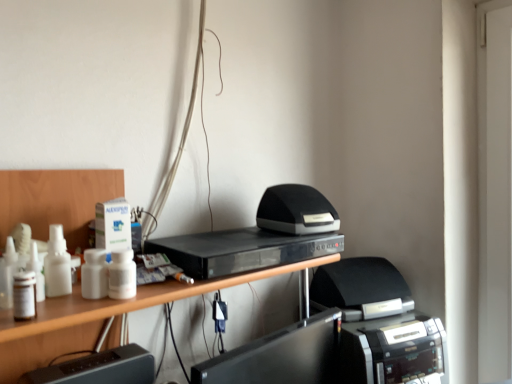
The width and height of the screenshot is (512, 384). Identify the location of black plastic register at lower left, acting as the 2th register starting from the right. (99, 368).

Identify the location of black glossy monitor at lower center, arranged as the 2th register when viewed from the left. (280, 356).

Measure the distance from black plastic printer at lower right, the second printer viewed from the top, to black glossy monitor at lower center, arranged as the 2th register when viewed from the left.

black plastic printer at lower right, the second printer viewed from the top, is 6.03 inches away from black glossy monitor at lower center, arranged as the 2th register when viewed from the left.

Considering the relative sizes of black plastic printer at lower right, which is the 1th printer in bottom-to-top order, and black glossy monitor at lower center, the first register from the right, in the image provided, is black plastic printer at lower right, which is the 1th printer in bottom-to-top order, shorter than black glossy monitor at lower center, the first register from the right,?

No.

From a real-world perspective, is black plastic printer at lower right, the second printer viewed from the top, positioned under black glossy monitor at lower center, the first register from the right, based on gravity?

Yes, from a real-world perspective, black plastic printer at lower right, the second printer viewed from the top, is under black glossy monitor at lower center, the first register from the right.

Image resolution: width=512 pixels, height=384 pixels. Find the location of `the 1st printer above when counting from the black glossy monitor at lower center, arranged as the 2th register when viewed from the left (from the image's perspective)`. the 1st printer above when counting from the black glossy monitor at lower center, arranged as the 2th register when viewed from the left (from the image's perspective) is located at coordinates (380, 324).

Is black plastic register at lower left, acting as the 2th register starting from the right, inside black plastic dvd player at center?

No, black plastic dvd player at center does not contain black plastic register at lower left, acting as the 2th register starting from the right.

Does black plastic dvd player at center have a lesser width compared to black plastic register at lower left, acting as the 2th register starting from the right?

Incorrect, the width of black plastic dvd player at center is not less than that of black plastic register at lower left, acting as the 2th register starting from the right.

Considering the relative sizes of black plastic dvd player at center and black plastic register at lower left, the first register positioned from the left, in the image provided, is black plastic dvd player at center bigger than black plastic register at lower left, the first register positioned from the left,?

Yes, black plastic dvd player at center is bigger than black plastic register at lower left, the first register positioned from the left.

From a real-world perspective, is black plastic dvd player at center positioned under black plastic register at lower left, acting as the 2th register starting from the right, based on gravity?

No, from a real-world perspective, black plastic dvd player at center is not under black plastic register at lower left, acting as the 2th register starting from the right.

How many degrees apart are the facing directions of black plastic register at lower left, the first register positioned from the left, and black glossy monitor at lower center, the first register from the right?

The angle between the facing direction of black plastic register at lower left, the first register positioned from the left, and the facing direction of black glossy monitor at lower center, the first register from the right, is 0.707 degrees.

Does black plastic register at lower left, the first register positioned from the left, have a lesser width compared to black glossy monitor at lower center, arranged as the 2th register when viewed from the left?

Yes, black plastic register at lower left, the first register positioned from the left, is thinner than black glossy monitor at lower center, arranged as the 2th register when viewed from the left.

Is point (135, 380) positioned in front of point (289, 359)?

Yes, point (135, 380) is in front of point (289, 359).

Is black glossy monitor at lower center, the first register from the right, inside black plastic register at lower left, acting as the 2th register starting from the right?

No, black glossy monitor at lower center, the first register from the right, is not a part of black plastic register at lower left, acting as the 2th register starting from the right.

Looking at this image, considering the relative positions of black glossy monitor at lower center, arranged as the 2th register when viewed from the left, and black plastic register at lower left, acting as the 2th register starting from the right, in the image provided, is black glossy monitor at lower center, arranged as the 2th register when viewed from the left, behind black plastic register at lower left, acting as the 2th register starting from the right,?

No.

Would you say black glossy monitor at lower center, arranged as the 2th register when viewed from the left, contains black plastic register at lower left, acting as the 2th register starting from the right?

That's incorrect, black plastic register at lower left, acting as the 2th register starting from the right, is not inside black glossy monitor at lower center, arranged as the 2th register when viewed from the left.

From a real-world perspective, which is physically above, black glossy monitor at lower center, arranged as the 2th register when viewed from the left, or black plastic register at lower left, the first register positioned from the left?

→ black plastic register at lower left, the first register positioned from the left, is physically above.

Can you tell me how much black glossy monitor at lower center, the first register from the right, and black plastic register at lower left, the first register positioned from the left, differ in facing direction?

The facing directions of black glossy monitor at lower center, the first register from the right, and black plastic register at lower left, the first register positioned from the left, are 0.707 degrees apart.

Does black matte speaker at center, the first printer positioned from the top, have a lesser height compared to black plastic register at lower left, acting as the 2th register starting from the right?

In fact, black matte speaker at center, the first printer positioned from the top, may be taller than black plastic register at lower left, acting as the 2th register starting from the right.

Based on the photo, considering the sizes of objects black matte speaker at center, the first printer positioned from the top, and black plastic register at lower left, the first register positioned from the left, in the image provided, who is thinner, black matte speaker at center, the first printer positioned from the top, or black plastic register at lower left, the first register positioned from the left,?

With smaller width is black plastic register at lower left, the first register positioned from the left.

Is black plastic register at lower left, the first register positioned from the left, at the back of black matte speaker at center, the first printer positioned from the top?

No, black matte speaker at center, the first printer positioned from the top, is not facing away from black plastic register at lower left, the first register positioned from the left.

Is black matte speaker at center, the first printer positioned from the top, at the left side of black plastic register at lower left, the first register positioned from the left?

No.

Does point (434, 343) come in front of point (300, 194)?

No, (434, 343) is further to viewer.

Is black plastic printer at lower right, which is the 1th printer in bottom-to-top order, in front of or behind black matte speaker at center, which ranks as the second printer in bottom-to-top order, in the image?

Visually, black plastic printer at lower right, which is the 1th printer in bottom-to-top order, is located behind black matte speaker at center, which ranks as the second printer in bottom-to-top order.

Is black plastic printer at lower right, which is the 1th printer in bottom-to-top order, with black matte speaker at center, the first printer positioned from the top?

black plastic printer at lower right, which is the 1th printer in bottom-to-top order, and black matte speaker at center, the first printer positioned from the top, are not in contact.

Considering the relative sizes of black plastic dvd player at center and black plastic printer at lower right, which is the 1th printer in bottom-to-top order, in the image provided, is black plastic dvd player at center wider than black plastic printer at lower right, which is the 1th printer in bottom-to-top order,?

No, black plastic dvd player at center is not wider than black plastic printer at lower right, which is the 1th printer in bottom-to-top order.

Is there a large distance between black plastic dvd player at center and black plastic printer at lower right, the second printer viewed from the top?

No, there isn't a large distance between black plastic dvd player at center and black plastic printer at lower right, the second printer viewed from the top.

From a real-world perspective, is black plastic dvd player at center physically located above or below black plastic printer at lower right, which is the 1th printer in bottom-to-top order?

Clearly, from a real-world perspective, black plastic dvd player at center is above black plastic printer at lower right, which is the 1th printer in bottom-to-top order.

Considering the positions of point (306, 254) and point (376, 278), is point (306, 254) closer or farther from the camera than point (376, 278)?

Point (306, 254).

Where is `the 2nd printer behind the black glossy monitor at lower center, arranged as the 2th register when viewed from the left, starting your count from the anchor`? This screenshot has width=512, height=384. the 2nd printer behind the black glossy monitor at lower center, arranged as the 2th register when viewed from the left, starting your count from the anchor is located at coordinates (380, 324).

Locate an element on the screen. The height and width of the screenshot is (384, 512). home appliance above the black plastic register at lower left, the first register positioned from the left (from a real-world perspective) is located at coordinates (241, 250).

In the scene shown: Which object lies nearer to the anchor point black plastic dvd player at center, black matte speaker at center, the first printer positioned from the top, or black glossy monitor at lower center, the first register from the right?

black matte speaker at center, the first printer positioned from the top, lies closer to black plastic dvd player at center than the other object.

In the scene shown: When comparing their distances from black glossy monitor at lower center, the first register from the right, does black plastic register at lower left, acting as the 2th register starting from the right, or black matte speaker at center, which ranks as the second printer in bottom-to-top order, seem further?

Among the two, black matte speaker at center, which ranks as the second printer in bottom-to-top order, is located further to black glossy monitor at lower center, the first register from the right.

Based on their spatial positions, is black matte speaker at center, the first printer positioned from the top, or black plastic dvd player at center closer to black plastic printer at lower right, the second printer viewed from the top?

black plastic dvd player at center.

Based on their spatial positions, is black glossy monitor at lower center, arranged as the 2th register when viewed from the left, or black plastic dvd player at center closer to black plastic register at lower left, acting as the 2th register starting from the right?

black glossy monitor at lower center, arranged as the 2th register when viewed from the left, is closer to black plastic register at lower left, acting as the 2th register starting from the right.

From the image, which object appears to be nearer to black plastic printer at lower right, which is the 1th printer in bottom-to-top order, black glossy monitor at lower center, arranged as the 2th register when viewed from the left, or black plastic dvd player at center?

Based on the image, black glossy monitor at lower center, arranged as the 2th register when viewed from the left, appears to be nearer to black plastic printer at lower right, which is the 1th printer in bottom-to-top order.

Consider the image. Estimate the real-world distances between objects in this image. Which object is further from black matte speaker at center, the first printer positioned from the top, black plastic dvd player at center or black glossy monitor at lower center, arranged as the 2th register when viewed from the left?

black glossy monitor at lower center, arranged as the 2th register when viewed from the left, is further to black matte speaker at center, the first printer positioned from the top.

From the picture: From the image, which object appears to be farther from black plastic register at lower left, the first register positioned from the left, black plastic dvd player at center or black matte speaker at center, the first printer positioned from the top?

black matte speaker at center, the first printer positioned from the top.

Based on the photo, when comparing their distances from black plastic printer at lower right, which is the 1th printer in bottom-to-top order, does black matte speaker at center, which ranks as the second printer in bottom-to-top order, or black plastic register at lower left, acting as the 2th register starting from the right, seem closer?

black matte speaker at center, which ranks as the second printer in bottom-to-top order, is closer to black plastic printer at lower right, which is the 1th printer in bottom-to-top order.

I want to click on home appliance between black matte speaker at center, the first printer positioned from the top, and black plastic printer at lower right, which is the 1th printer in bottom-to-top order, vertically, so click(x=241, y=250).

Locate an element on the screen. The width and height of the screenshot is (512, 384). register situated between black plastic register at lower left, the first register positioned from the left, and black plastic printer at lower right, which is the 1th printer in bottom-to-top order, from left to right is located at coordinates (280, 356).

This screenshot has height=384, width=512. What are the coordinates of `home appliance between black plastic register at lower left, the first register positioned from the left, and black matte speaker at center, the first printer positioned from the top` in the screenshot? It's located at (241, 250).

In order to click on home appliance between black matte speaker at center, which ranks as the second printer in bottom-to-top order, and black glossy monitor at lower center, arranged as the 2th register when viewed from the left, from top to bottom in this screenshot , I will do `click(241, 250)`.